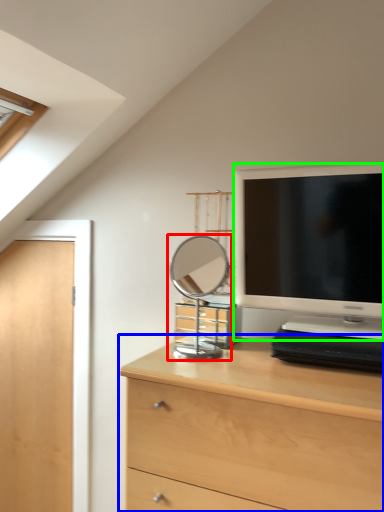
Question: Estimate the real-world distances between objects in this image. Which object is closer to mirror (highlighted by a red box), chest of drawers (highlighted by a blue box) or television (highlighted by a green box)?

Choices:
 (A) chest of drawers
 (B) television

Answer: (B)